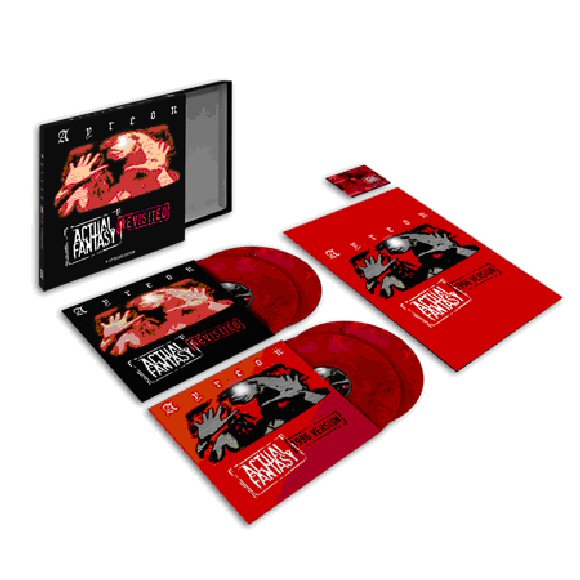
Locate an element on the screen. The image size is (580, 580). dvd is located at coordinates (275, 288), (309, 278), (374, 385), (412, 369).